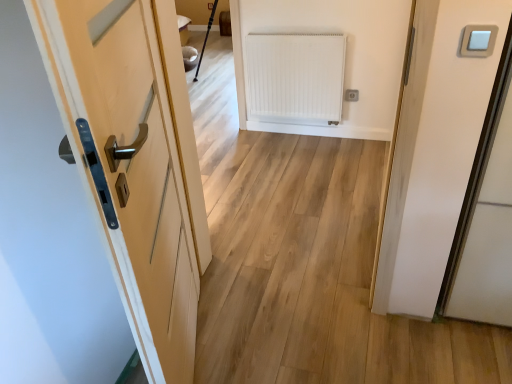
Identify the location of vacant space to the right of matte wood door at left. (283, 338).